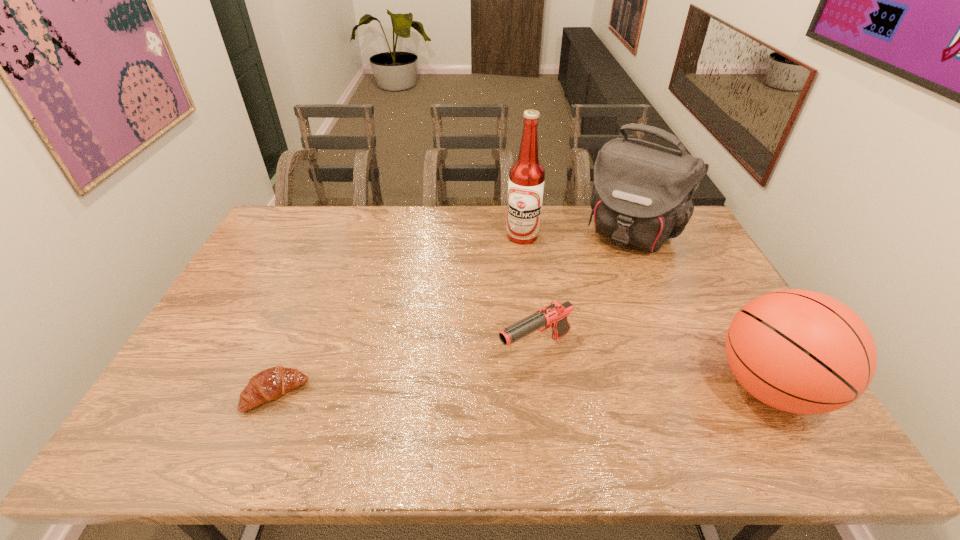
This screenshot has height=540, width=960. Find the location of `object that stands as the third closest to the third tallest object`. object that stands as the third closest to the third tallest object is located at coordinates (526, 182).

In order to click on the third closest object to the fourth tallest object in this screenshot , I will do `click(526, 182)`.